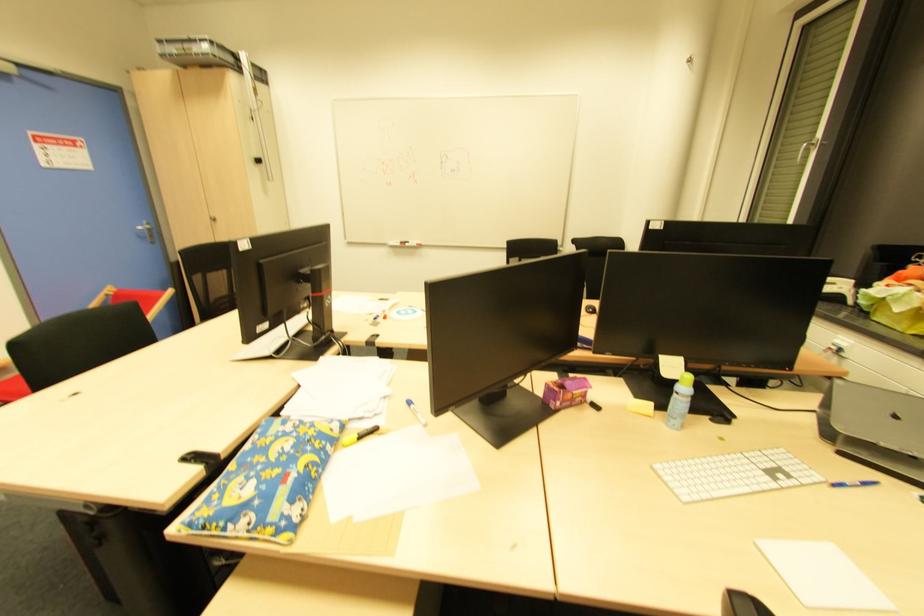
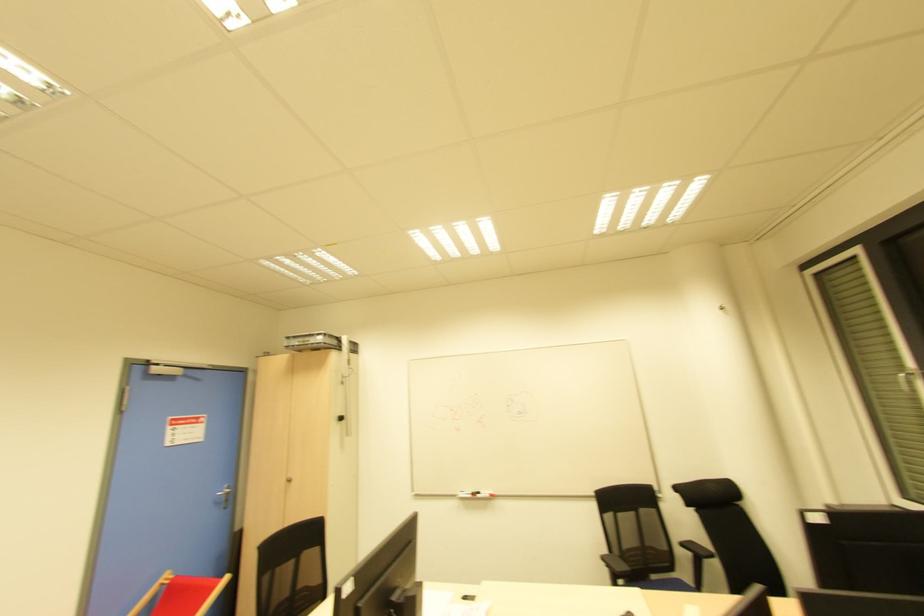
Find the pixel in the second image that matches point 152,238 in the first image.

(225, 501)